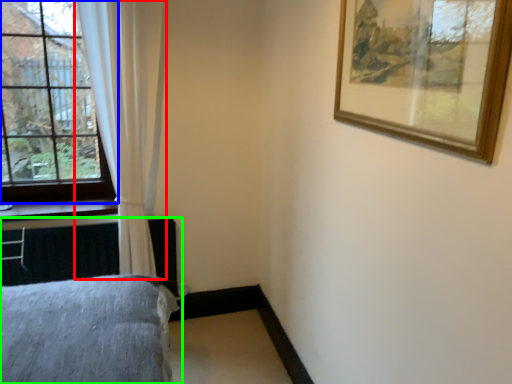
Question: Which is nearer to the curtain (highlighted by a red box)? window (highlighted by a blue box) or bed (highlighted by a green box).

Choices:
 (A) window
 (B) bed

Answer: (A)